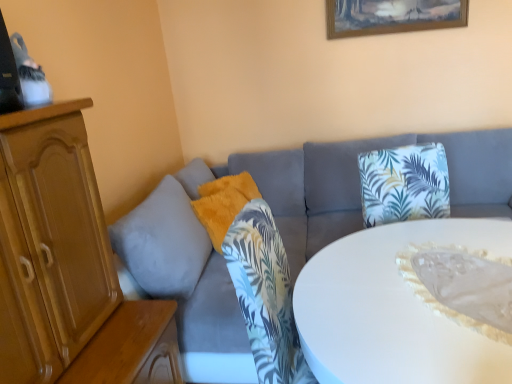
Question: From a real-world perspective, is fuzzy orange pillow at center below white glossy table at center?

Choices:
 (A) no
 (B) yes

Answer: (A)

Question: Can you confirm if fuzzy orange pillow at center is bigger than white glossy table at center?

Choices:
 (A) no
 (B) yes

Answer: (A)

Question: Does fuzzy orange pillow at center have a greater width compared to white glossy table at center?

Choices:
 (A) no
 (B) yes

Answer: (A)

Question: Are fuzzy orange pillow at center and white glossy table at center making contact?

Choices:
 (A) no
 (B) yes

Answer: (A)

Question: Is fuzzy orange pillow at center not close to white glossy table at center?

Choices:
 (A) yes
 (B) no

Answer: (A)

Question: In terms of height, does velvet gray couch at center look taller or shorter compared to wooden picture frame at upper center?

Choices:
 (A) short
 (B) tall

Answer: (B)

Question: Considering the positions of velvet gray couch at center and wooden picture frame at upper center in the image, is velvet gray couch at center wider or thinner than wooden picture frame at upper center?

Choices:
 (A) wide
 (B) thin

Answer: (A)

Question: Considering their positions, is velvet gray couch at center located in front of or behind wooden picture frame at upper center?

Choices:
 (A) front
 (B) behind

Answer: (A)

Question: Considering the positions of point click(164, 206) and point click(381, 4), is point click(164, 206) closer or farther from the camera than point click(381, 4)?

Choices:
 (A) farther
 (B) closer

Answer: (B)

Question: Would you say velvet gray couch at center is to the left or to the right of white glossy table at center in the picture?

Choices:
 (A) right
 (B) left

Answer: (B)

Question: Which is correct: velvet gray couch at center is inside white glossy table at center, or outside of it?

Choices:
 (A) inside
 (B) outside

Answer: (B)

Question: In terms of height, does velvet gray couch at center look taller or shorter compared to white glossy table at center?

Choices:
 (A) tall
 (B) short

Answer: (A)

Question: Is point (449, 147) positioned closer to the camera than point (356, 292)?

Choices:
 (A) closer
 (B) farther

Answer: (B)

Question: Is wooden picture frame at upper center to the left or to the right of white glossy table at center in the image?

Choices:
 (A) right
 (B) left

Answer: (A)

Question: Considering the positions of wooden picture frame at upper center and white glossy table at center in the image, is wooden picture frame at upper center taller or shorter than white glossy table at center?

Choices:
 (A) tall
 (B) short

Answer: (B)